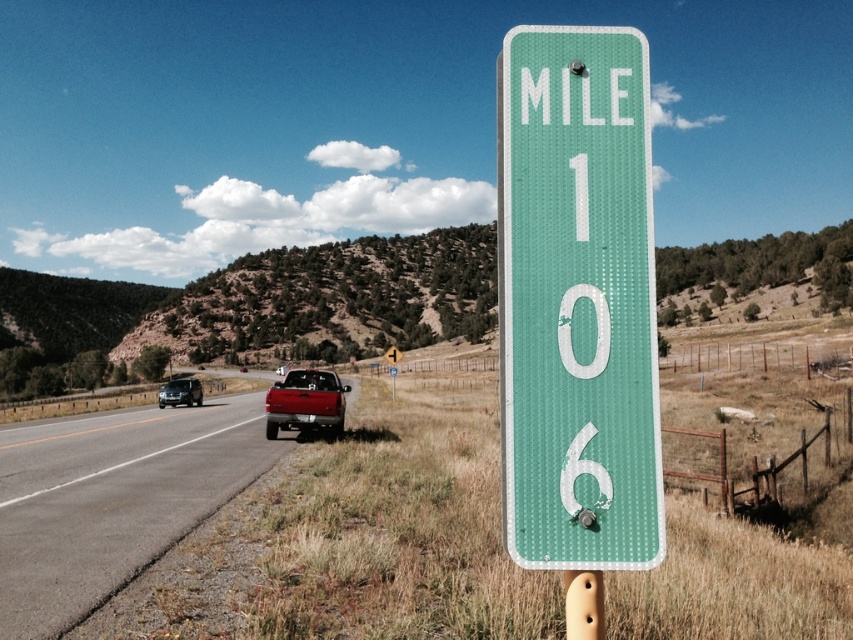
Question: Is metallic gray truck at center further to camera compared to green textured pole at center?

Choices:
 (A) no
 (B) yes

Answer: (B)

Question: Does metallic gray truck at center appear on the right side of green textured pole at center?

Choices:
 (A) no
 (B) yes

Answer: (A)

Question: Does matte red truck at center have a lesser width compared to green textured pole at center?

Choices:
 (A) yes
 (B) no

Answer: (B)

Question: Which object appears closest to the camera in this image?

Choices:
 (A) metallic gray truck at center
 (B) green textured pole at center
 (C) matte red truck at center
 (D) matte black suv at left

Answer: (B)

Question: Which is farther from the green textured sign at center?

Choices:
 (A) matte black suv at left
 (B) matte red truck at center
 (C) green textured pole at center
 (D) metallic gray truck at center

Answer: (A)

Question: Which point is farther to the camera?

Choices:
 (A) metallic gray truck at center
 (B) matte red truck at center

Answer: (B)